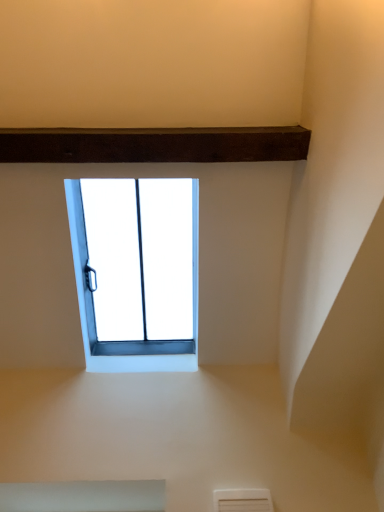
Question: Relative to white plastic window at center, is white plastic air conditioning at lower center in front or behind?

Choices:
 (A) behind
 (B) front

Answer: (A)

Question: From a real-world perspective, is white plastic air conditioning at lower center physically located above or below white plastic window at center?

Choices:
 (A) below
 (B) above

Answer: (A)

Question: From the image's perspective, is white plastic air conditioning at lower center located above or below white plastic window at center?

Choices:
 (A) above
 (B) below

Answer: (B)

Question: Is white plastic window at center inside the boundaries of white plastic air conditioning at lower center, or outside?

Choices:
 (A) inside
 (B) outside

Answer: (B)

Question: In the image, is white plastic window at center positioned in front of or behind white plastic air conditioning at lower center?

Choices:
 (A) behind
 (B) front

Answer: (B)

Question: From the image's perspective, is white plastic window at center located above or below white plastic air conditioning at lower center?

Choices:
 (A) above
 (B) below

Answer: (A)

Question: Is point (66, 195) closer or farther from the camera than point (256, 502)?

Choices:
 (A) farther
 (B) closer

Answer: (A)